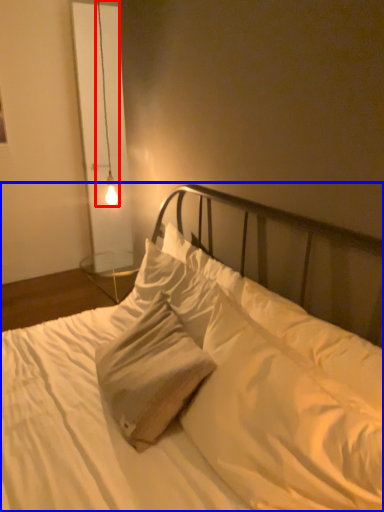
Question: Which object appears closest to the camera in this image, lamp (highlighted by a red box) or bed (highlighted by a blue box)?

Choices:
 (A) lamp
 (B) bed

Answer: (B)